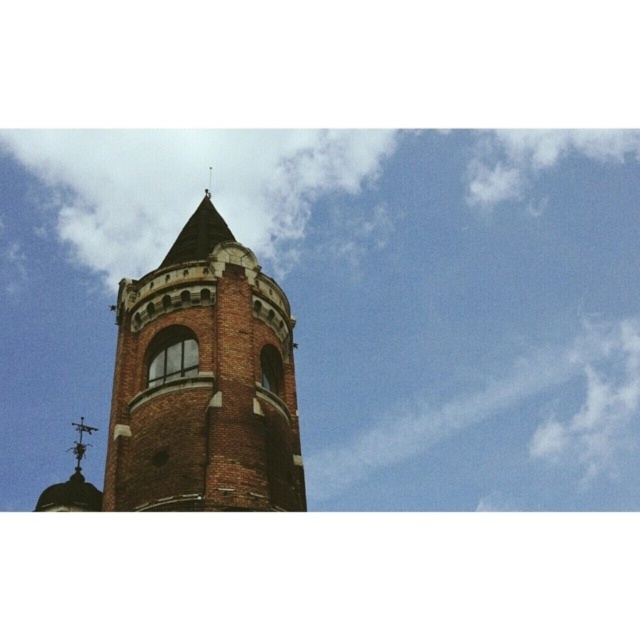
Question: Which point is farther to the camera?

Choices:
 (A) (81, 426)
 (B) (100, 195)
 (C) (304, 500)

Answer: (B)

Question: In this image, where is brick tower at center located relative to polished metal spire at upper center?

Choices:
 (A) above
 (B) below

Answer: (A)

Question: Which point appears closest to the camera in this image?

Choices:
 (A) (77, 436)
 (B) (124, 388)

Answer: (B)

Question: Does brick tower at center appear on the left side of polished metal spire at upper center?

Choices:
 (A) no
 (B) yes

Answer: (A)

Question: Can you confirm if brick tower at center is smaller than polished metal spire at upper center?

Choices:
 (A) no
 (B) yes

Answer: (B)

Question: Which point appears closest to the camera in this image?

Choices:
 (A) (442, 429)
 (B) (81, 424)
 (C) (296, 442)

Answer: (C)